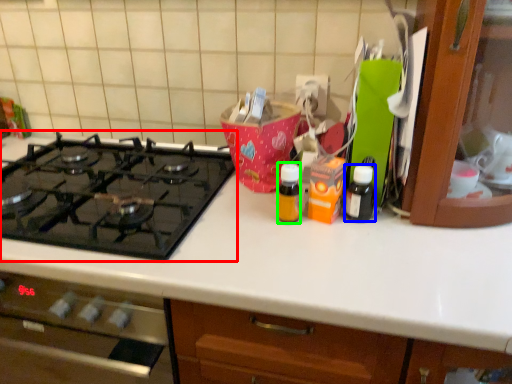
Question: Based on their relative distances, which object is nearer to gas stove (highlighted by a red box)? Choose from bottle (highlighted by a blue box) and bottle (highlighted by a green box).

Choices:
 (A) bottle
 (B) bottle

Answer: (B)